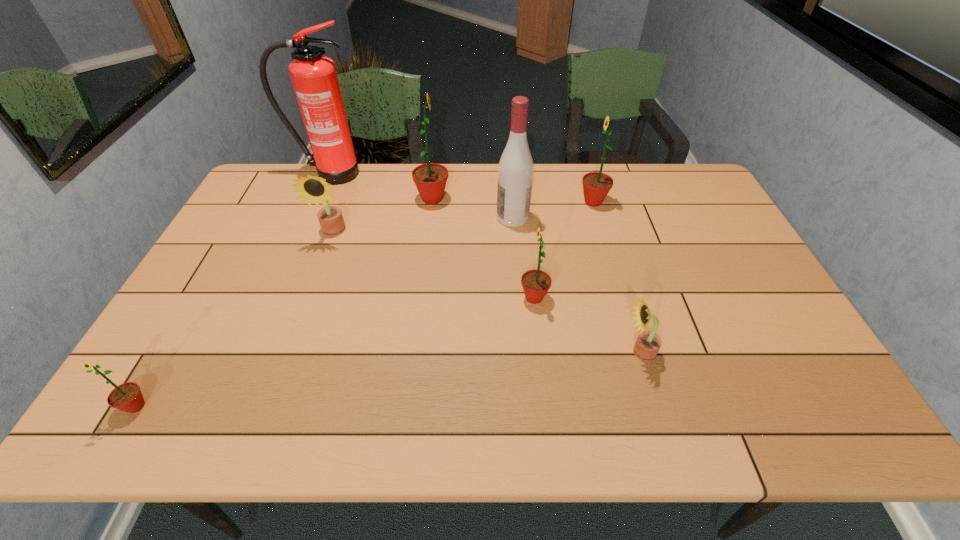
Locate an element on the screen. vacant space located on the face of the fourth tallest object is located at coordinates (564, 202).

The width and height of the screenshot is (960, 540). Find the location of `vacant space situated 0.120m on the face of the fourth tallest object`. vacant space situated 0.120m on the face of the fourth tallest object is located at coordinates (542, 202).

Find the location of a particular element. vacant space located on the face of the fourth tallest object is located at coordinates (555, 202).

Locate an element on the screen. blank space located 0.180m on the face of the third nearest sunflower is located at coordinates coord(451,298).

The width and height of the screenshot is (960, 540). Find the location of `vacant space located 0.230m on the face of the third nearest sunflower`. vacant space located 0.230m on the face of the third nearest sunflower is located at coordinates (433, 298).

Identify the location of vacant space located 0.200m on the face of the third nearest sunflower. (444, 298).

This screenshot has width=960, height=540. What are the coordinates of `blank space located on the face of the bigger yellow sunflower` in the screenshot? It's located at pyautogui.click(x=295, y=340).

Identify the location of vacant space situated on the face of the seventh farthest object. (515, 352).

The image size is (960, 540). Identify the location of vacant space located on the face of the seventh farthest object. (582, 352).

This screenshot has height=540, width=960. Identify the location of vacant space located 0.110m on the face of the seventh farthest object. (577, 352).